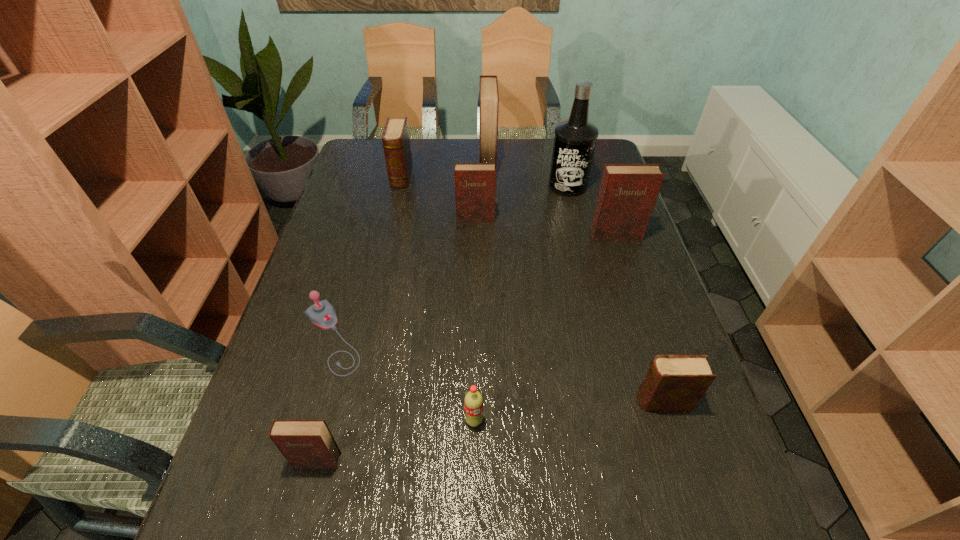
Identify which diary is located as the fifth nearest to the soda. Please provide its 2D coordinates. Your answer should be formatted as a tuple, i.e. [(x, y)], where the tuple contains the x and y coordinates of a point satisfying the conditions above.

[(396, 143)]

Locate an element on the screen. This screenshot has width=960, height=540. reddish-brown diary object that ranks as the second closest to the nearest object is located at coordinates (628, 192).

Image resolution: width=960 pixels, height=540 pixels. Identify the location of reddish-brown diary that is the third nearest to the biggest reddish-brown diary. (304, 443).

Locate an element on the screen. free space that satisfies the following two spatial constraints: 1. on the front cover of the tallest diary; 2. on the front cover of the smallest reddish-brown diary is located at coordinates (494, 461).

Locate an element on the screen. This screenshot has height=540, width=960. free space that satisfies the following two spatial constraints: 1. on the front cover of the farthest reddish-brown diary; 2. on the spine side of the left brown diary is located at coordinates (488, 177).